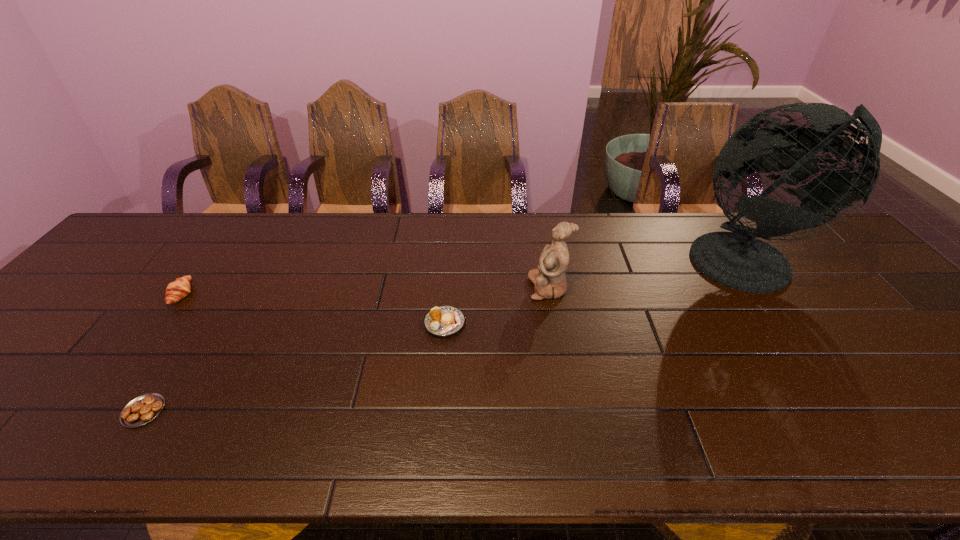
Find the location of a particular element. The image size is (960, 540). vacant point that satisfies the following two spatial constraints: 1. on the front-facing side of the rightmost object; 2. on the front-facing side of the second object from right to left is located at coordinates (770, 288).

This screenshot has height=540, width=960. I want to click on free spot that satisfies the following two spatial constraints: 1. on the front-facing side of the figurine; 2. on the front side of the shortest object, so click(x=570, y=411).

What are the coordinates of `vacant space that satisfies the following two spatial constraints: 1. on the front-facing side of the tallest pastry; 2. on the right side of the second shortest object` in the screenshot? It's located at (160, 323).

Identify the location of blank area in the image that satisfies the following two spatial constraints: 1. on the front-facing side of the tallest pastry; 2. on the back side of the second shortest pastry. This screenshot has width=960, height=540. (160, 323).